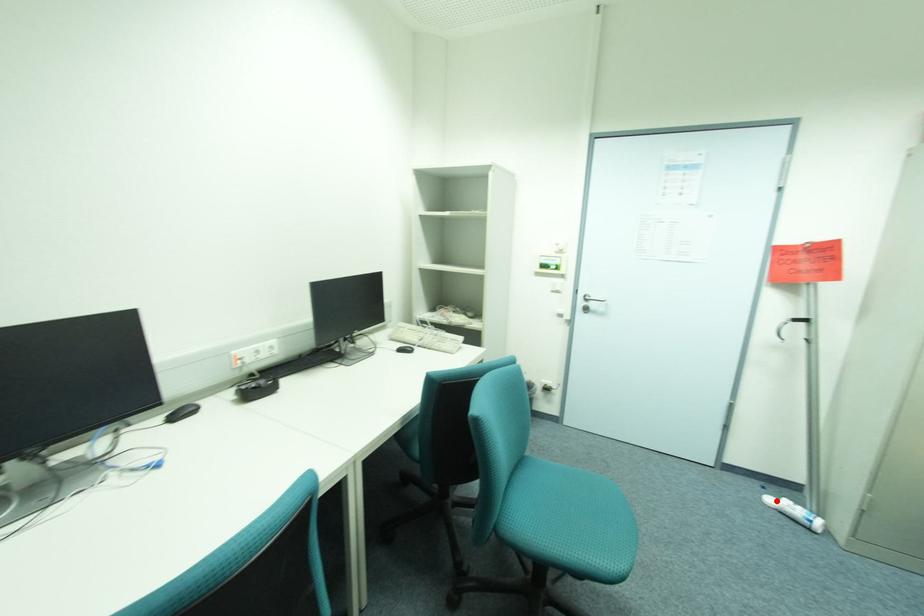
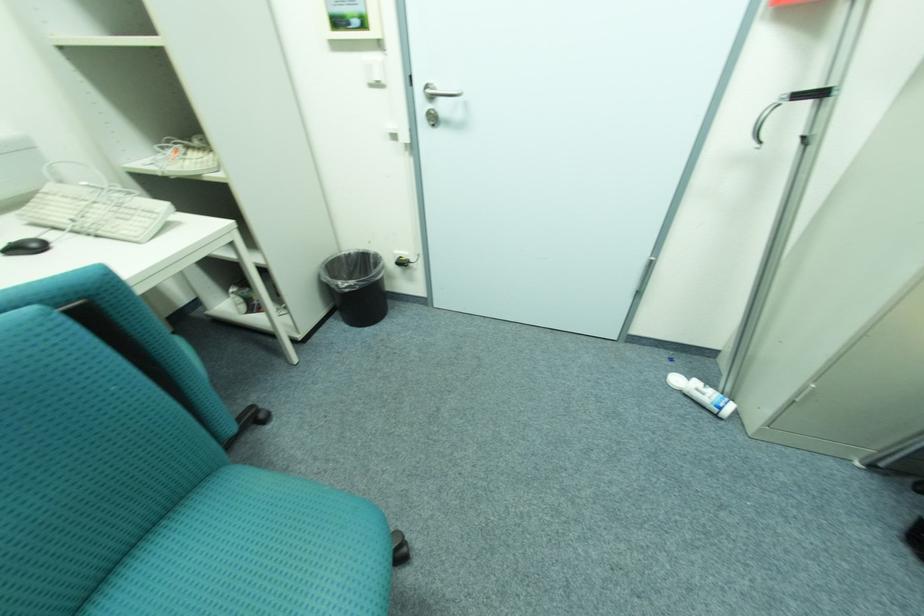
Locate, in the second image, the point that corresponds to the highlighted location in the first image.

(683, 381)